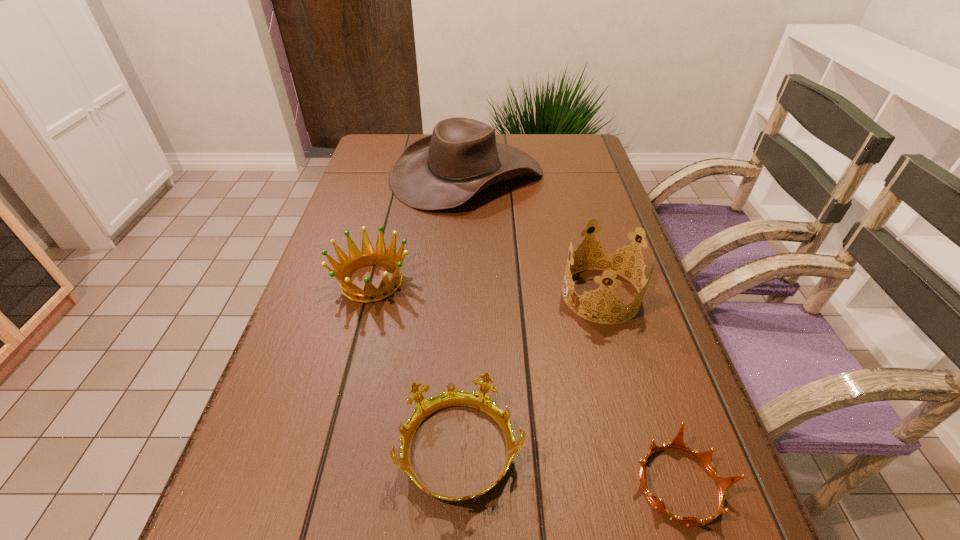
In order to click on vacant region between the shortest crown and the cowboy hat in this screenshot , I will do `click(573, 329)`.

Where is `free space between the cowboy hat and the tallest crown`? free space between the cowboy hat and the tallest crown is located at coordinates (534, 234).

Find the location of a particular element. This screenshot has width=960, height=540. unoccupied position between the tallest crown and the second crown from left to right is located at coordinates (531, 373).

I want to click on empty space between the fourth tallest object and the farthest object, so click(464, 313).

The width and height of the screenshot is (960, 540). In order to click on empty space between the tallest crown and the leftmost crown in this screenshot , I will do `click(487, 288)`.

You are a GUI agent. You are given a task and a screenshot of the screen. Output one action in this format:
    pyautogui.click(x=<x>, y=<y>)
    Task: Click on the free space between the tallest crown and the third tallest crown
    Image resolution: width=960 pixels, height=540 pixels.
    Given the screenshot: What is the action you would take?
    pyautogui.click(x=531, y=373)

The width and height of the screenshot is (960, 540). I want to click on unoccupied area between the farthest object and the tallest crown, so click(x=534, y=234).

The width and height of the screenshot is (960, 540). Identify the location of free space between the farthest object and the leftmost crown. (420, 228).

I want to click on unoccupied position between the third crown from right to left and the leftmost crown, so click(416, 367).

Image resolution: width=960 pixels, height=540 pixels. I want to click on object that is the fourth closest one to the tallest crown, so click(356, 260).